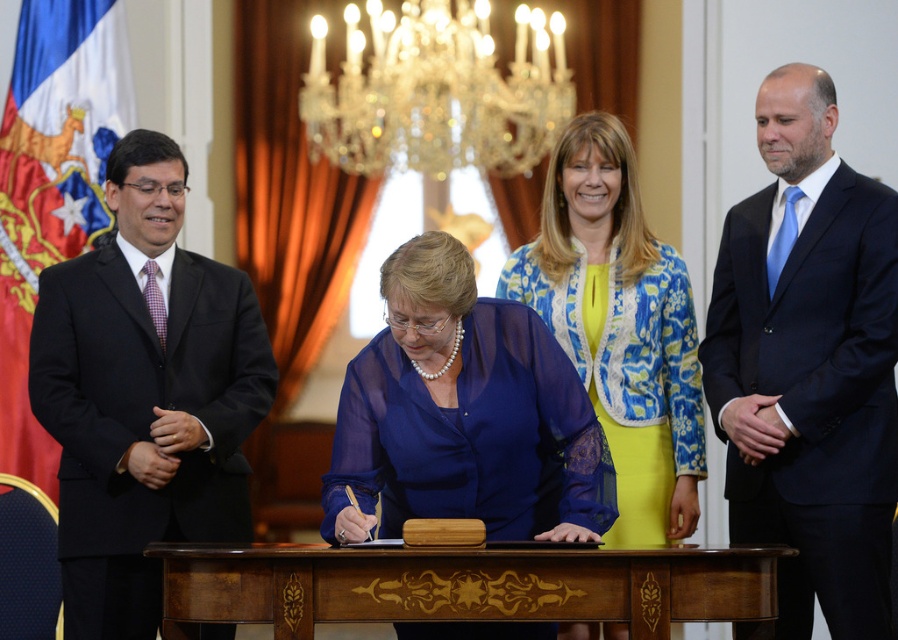
Question: Is blue silk suit at right further to the viewer compared to crystal glass chandelier at upper center?

Choices:
 (A) no
 (B) yes

Answer: (A)

Question: Which object is positioned closest to the blue silk suit at right?

Choices:
 (A) wooden at center
 (B) silky fabric flag at left
 (C) black suit at left
 (D) blue sheer blouse at center

Answer: (D)

Question: Observing the image, what is the correct spatial positioning of blue floral jacket at center in reference to silky fabric flag at left?

Choices:
 (A) below
 (B) above

Answer: (A)

Question: Which point is farther to the camera?

Choices:
 (A) blue floral jacket at center
 (B) blue sheer blouse at center
 (C) blue silk suit at right

Answer: (A)

Question: Is blue sheer blouse at center to the left of crystal glass chandelier at upper center from the viewer's perspective?

Choices:
 (A) yes
 (B) no

Answer: (B)

Question: Which point is farther to the camera?

Choices:
 (A) (367, 128)
 (B) (429, 282)
 (C) (797, 234)

Answer: (A)